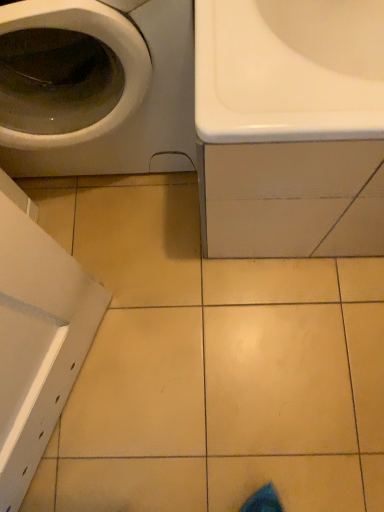
Question: Is point (243, 242) positioned closer to the camera than point (16, 52)?

Choices:
 (A) farther
 (B) closer

Answer: (A)

Question: In terms of height, does white glossy sink at upper right look taller or shorter compared to white glossy washing machine at upper left?

Choices:
 (A) tall
 (B) short

Answer: (B)

Question: Considering their positions, is white glossy sink at upper right located in front of or behind white glossy washing machine at upper left?

Choices:
 (A) front
 (B) behind

Answer: (B)

Question: In terms of width, does white glossy washing machine at upper left look wider or thinner when compared to white glossy sink at upper right?

Choices:
 (A) thin
 (B) wide

Answer: (A)

Question: In the image, is white glossy washing machine at upper left on the left side or the right side of white glossy sink at upper right?

Choices:
 (A) left
 (B) right

Answer: (A)

Question: Relative to white glossy sink at upper right, is white glossy washing machine at upper left in front or behind?

Choices:
 (A) front
 (B) behind

Answer: (A)

Question: Considering the positions of white glossy washing machine at upper left and white glossy sink at upper right in the image, is white glossy washing machine at upper left bigger or smaller than white glossy sink at upper right?

Choices:
 (A) small
 (B) big

Answer: (A)